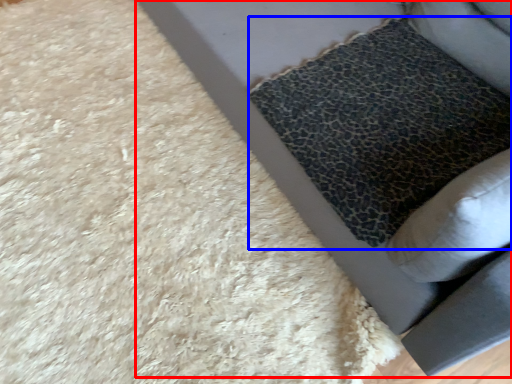
Question: Which of the following is the closest to the observer, furniture (highlighted by a red box) or pillow (highlighted by a blue box)?

Choices:
 (A) furniture
 (B) pillow

Answer: (A)